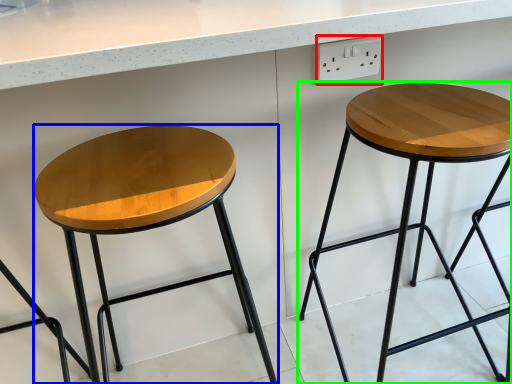
Question: Which object is positioned farthest from electric outlet (highlighted by a red box)? Select from stool (highlighted by a blue box) and stool (highlighted by a green box).

Choices:
 (A) stool
 (B) stool

Answer: (A)